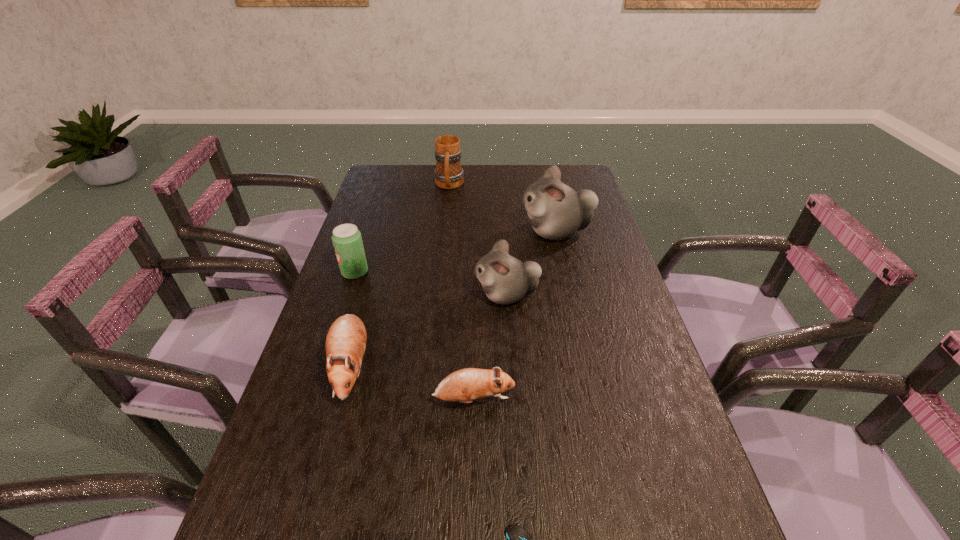
Identify the location of object located in the far edge section of the desktop. (448, 174).

The image size is (960, 540). Identify the location of soda located at the left edge. (347, 240).

Locate an element on the screen. The image size is (960, 540). hamster present at the left edge is located at coordinates (345, 345).

Locate an element on the screen. The width and height of the screenshot is (960, 540). object present at the right edge is located at coordinates (556, 211).

Locate an element on the screen. free spot at the far edge of the desktop is located at coordinates (475, 165).

This screenshot has height=540, width=960. Find the location of `vacant region at the left edge of the desktop`. vacant region at the left edge of the desktop is located at coordinates (303, 411).

In the image, there is a desktop. At what (x,y) coordinates should I click in order to perform the action: click on vacant space at the right edge. Please return your answer as a coordinate pair (x, y). The height and width of the screenshot is (540, 960). Looking at the image, I should click on (616, 281).

This screenshot has height=540, width=960. Identify the location of free point at the far left corner. (410, 189).

Where is `free space between the shortest hamster and the smaller white hamster`? Image resolution: width=960 pixels, height=540 pixels. free space between the shortest hamster and the smaller white hamster is located at coordinates (490, 347).

Identify the location of vacant space that is in between the farthest object and the right brown hamster. (462, 293).